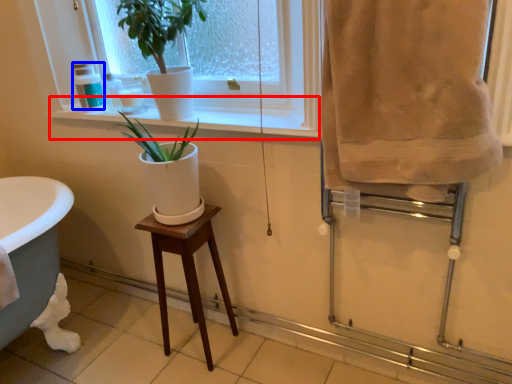
Question: Which point is further to the camera, window sill (highlighted by a red box) or toiletry (highlighted by a blue box)?

Choices:
 (A) window sill
 (B) toiletry

Answer: (B)